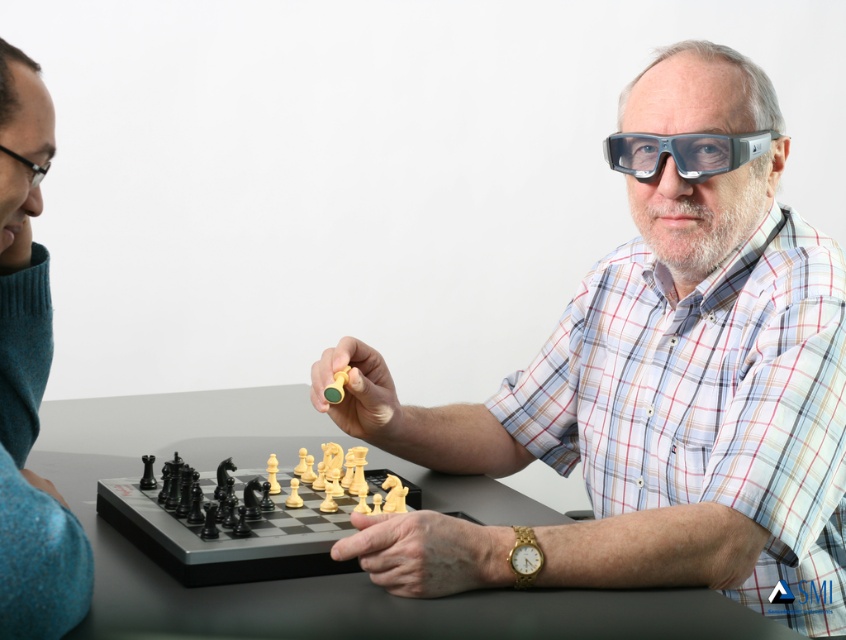
Which is above, black plastic table at center or teal wool sweater at left?

teal wool sweater at left is higher up.

Can you confirm if black plastic table at center is thinner than teal wool sweater at left?

No.

Identify the location of black plastic table at center. (311, 577).

At what (x,y) coordinates should I click in order to perform the action: click on black plastic table at center. Please return your answer as a coordinate pair (x, y). Looking at the image, I should click on (311, 577).

Does black plastic chess pieces at center have a larger size compared to transparent plastic goggles at center?

Indeed, black plastic chess pieces at center has a larger size compared to transparent plastic goggles at center.

Can you confirm if black plastic chess pieces at center is positioned below transparent plastic goggles at center?

Yes.

Is point (295, 529) positioned after point (777, 132)?

No, it is not.

This screenshot has width=846, height=640. I want to click on black plastic chess pieces at center, so click(279, 506).

Who is positioned more to the left, clear plastic glasses at center or teal wool sweater at left?

teal wool sweater at left

Is clear plastic glasses at center to the right of teal wool sweater at left from the viewer's perspective?

Yes, clear plastic glasses at center is to the right of teal wool sweater at left.

Is point (777, 573) in front of point (28, 131)?

No, it is behind (28, 131).

At what (x,y) coordinates should I click in order to perform the action: click on clear plastic glasses at center. Please return your answer as a coordinate pair (x, y). This screenshot has width=846, height=640. Looking at the image, I should click on (651, 417).